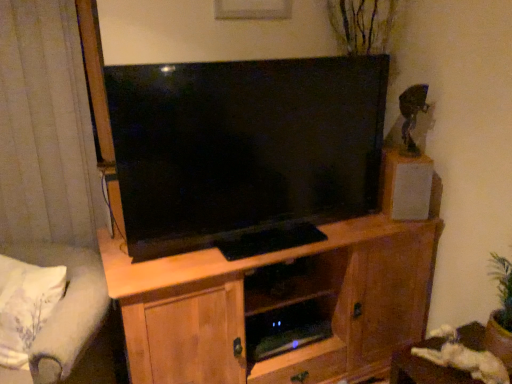
Find the location of a particular element. vacant area situated to the left side of white matte speaker at upper right is located at coordinates (368, 219).